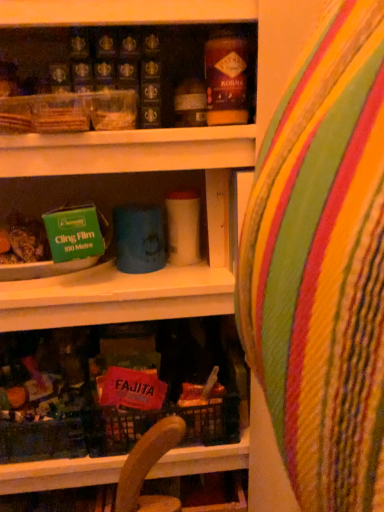
Question: Is matte brown jar at upper center in front of or behind multicolored striped bean bag chair at center in the image?

Choices:
 (A) behind
 (B) front

Answer: (A)

Question: Would you say matte brown jar at upper center is inside or outside multicolored striped bean bag chair at center?

Choices:
 (A) outside
 (B) inside

Answer: (A)

Question: Is matte brown jar at upper center bigger or smaller than multicolored striped bean bag chair at center?

Choices:
 (A) small
 (B) big

Answer: (A)

Question: Based on their positions, is multicolored striped bean bag chair at center located to the left or right of matte brown jar at upper center?

Choices:
 (A) left
 (B) right

Answer: (B)

Question: In terms of size, does multicolored striped bean bag chair at center appear bigger or smaller than matte brown jar at upper center?

Choices:
 (A) small
 (B) big

Answer: (B)

Question: In the image, is multicolored striped bean bag chair at center positioned in front of or behind matte brown jar at upper center?

Choices:
 (A) front
 (B) behind

Answer: (A)

Question: Would you say multicolored striped bean bag chair at center is inside or outside matte brown jar at upper center?

Choices:
 (A) outside
 (B) inside

Answer: (A)